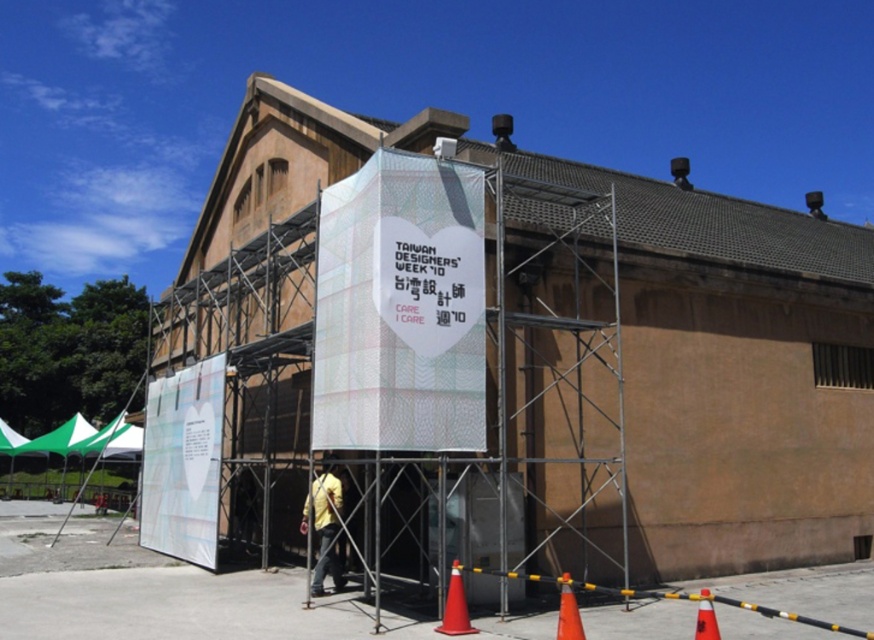
Question: Which point is farther to the camera?

Choices:
 (A) transparent fabric banner at center
 (B) orange matte traffic cone at lower right

Answer: (A)

Question: Which object is positioned closest to the orange matte traffic cone at lower right?

Choices:
 (A) transparent fabric banner at center
 (B) orange plastic cone at lower center
 (C) yellow matte shirt at center

Answer: (B)

Question: In this image, where is transparent fabric banner at center located relative to orange matte traffic cone at lower right?

Choices:
 (A) left
 (B) right

Answer: (A)

Question: Which object appears closest to the camera in this image?

Choices:
 (A) transparent fabric banner at center
 (B) orange matte traffic cone at lower right
 (C) orange plastic cone at lower center
 (D) orange matte cone at lower right

Answer: (B)

Question: Is transparent fabric banner at center below orange plastic cone at lower center?

Choices:
 (A) yes
 (B) no

Answer: (B)

Question: Does orange plastic cone at lower center have a smaller size compared to orange matte traffic cone at lower right?

Choices:
 (A) no
 (B) yes

Answer: (A)